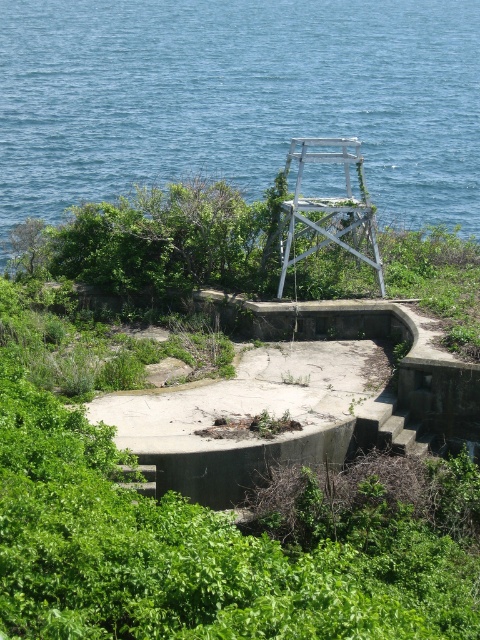
Question: Where is blue water at upper center located in relation to green leafy vegetation at center in the image?

Choices:
 (A) above
 (B) below

Answer: (A)

Question: Which point appears closest to the camera in this image?

Choices:
 (A) (230, 124)
 (B) (12, 588)

Answer: (B)

Question: Can you confirm if blue water at upper center is smaller than green leafy vegetation at center?

Choices:
 (A) yes
 (B) no

Answer: (B)

Question: Considering the relative positions of blue water at upper center and green leafy vegetation at center in the image provided, where is blue water at upper center located with respect to green leafy vegetation at center?

Choices:
 (A) right
 (B) left

Answer: (B)

Question: Among these objects, which one is farthest from the camera?

Choices:
 (A) blue water at upper center
 (B) green leafy vegetation at center

Answer: (A)